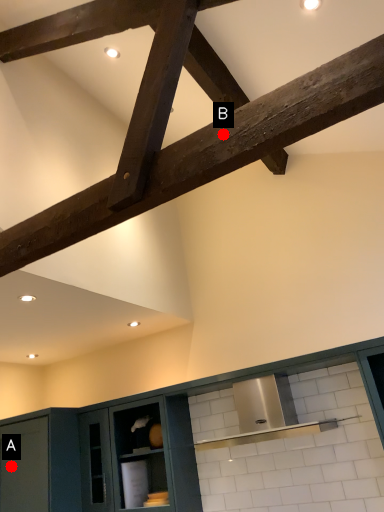
Question: Two points are circled on the image, labeled by A and B beside each circle. Among these points, which one is nearest to the camera?

Choices:
 (A) A is closer
 (B) B is closer

Answer: (B)